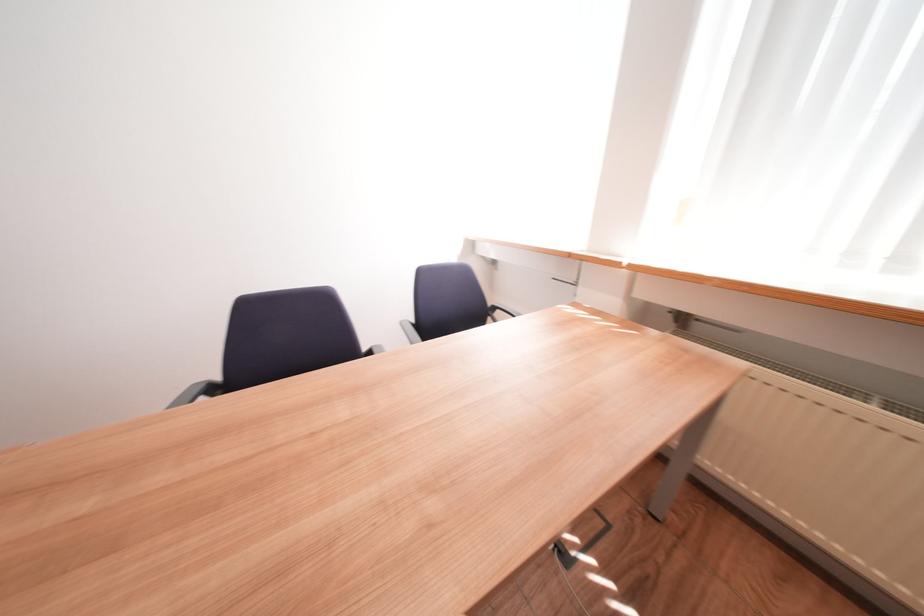
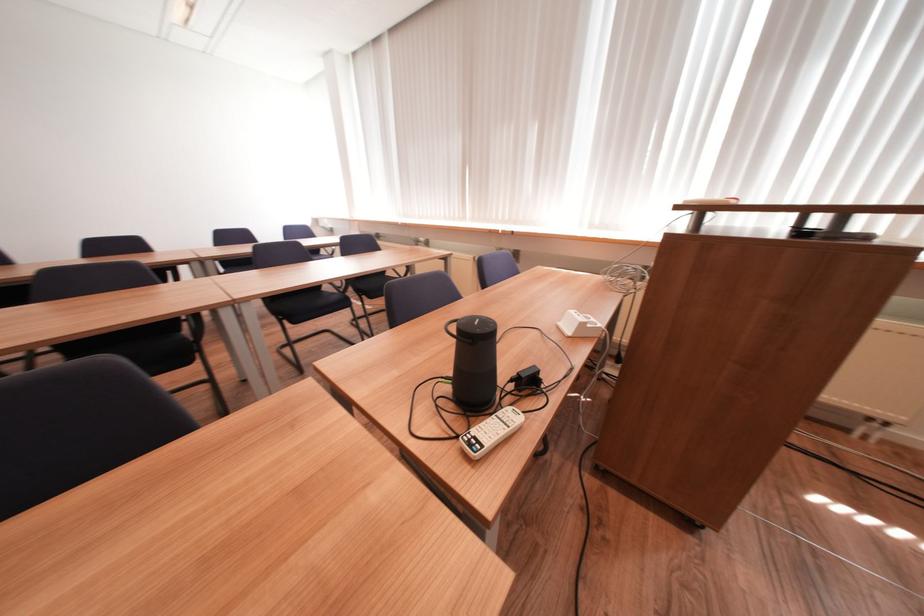
Question: What movement of the cameraman would produce the second image?

Choices:
 (A) Left
 (B) Right
 (C) Forward
 (D) Backward

Answer: (D)